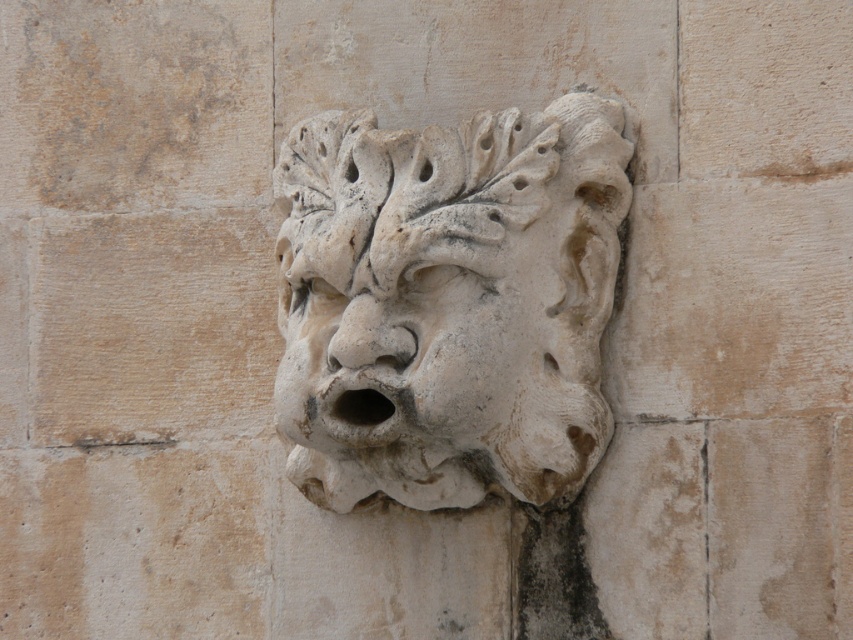
You are standing at point (312,192) and want to reach a door located at the opposite side of the wall. The sculpture is in your way. Can you walk around it without crossing the sculpture area? The sculpture is 12.03 meters away from you.

The distance between you at point (312,192) and the door is 12.03 meters. Since the sculpture is in your path, you can walk around it either to the left or right side to avoid crossing the sculpture area. The distance remains the same as the path around would still be approximately 12.03 meters.